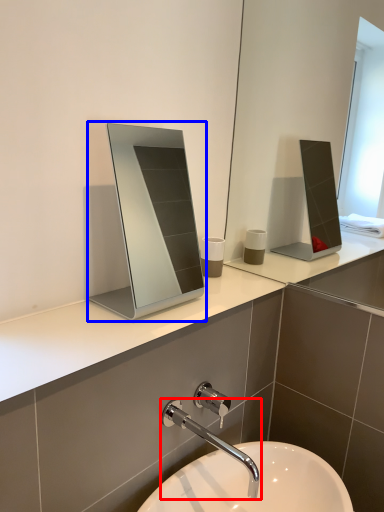
Question: Among these objects, which one is farthest to the camera, tap (highlighted by a red box) or medicine cabinet (highlighted by a blue box)?

Choices:
 (A) tap
 (B) medicine cabinet

Answer: (B)